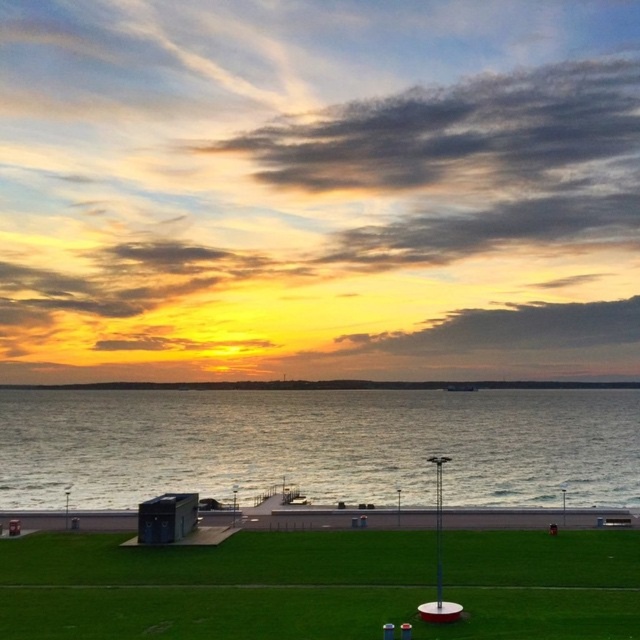
Is silvery reflective water at lower center to the left of green grass at lower center from the viewer's perspective?

Indeed, silvery reflective water at lower center is positioned on the left side of green grass at lower center.

Is silvery reflective water at lower center below green grass at lower center?

Yes.

Who is more forward, (144, 390) or (168, 604)?

Point (168, 604)

Identify the location of silvery reflective water at lower center. (321, 445).